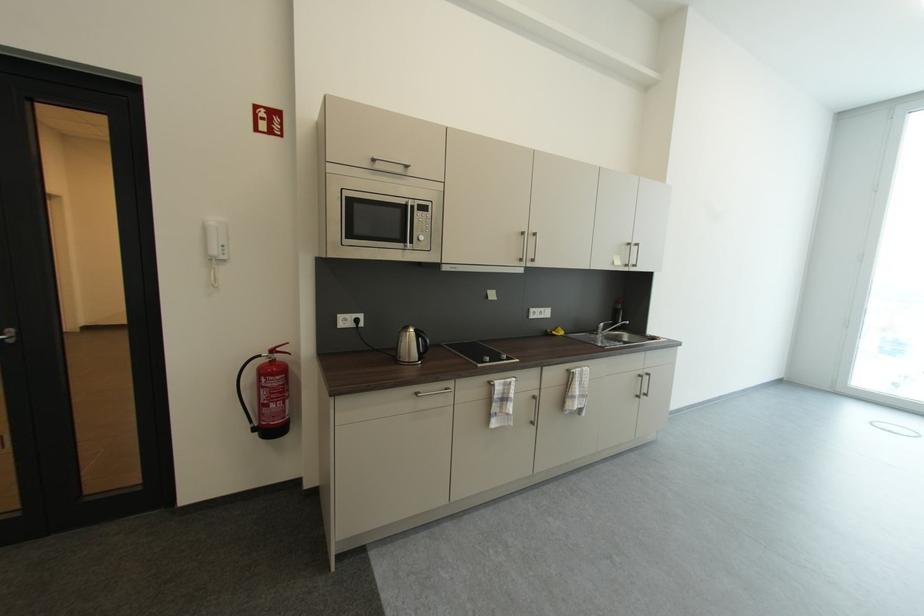
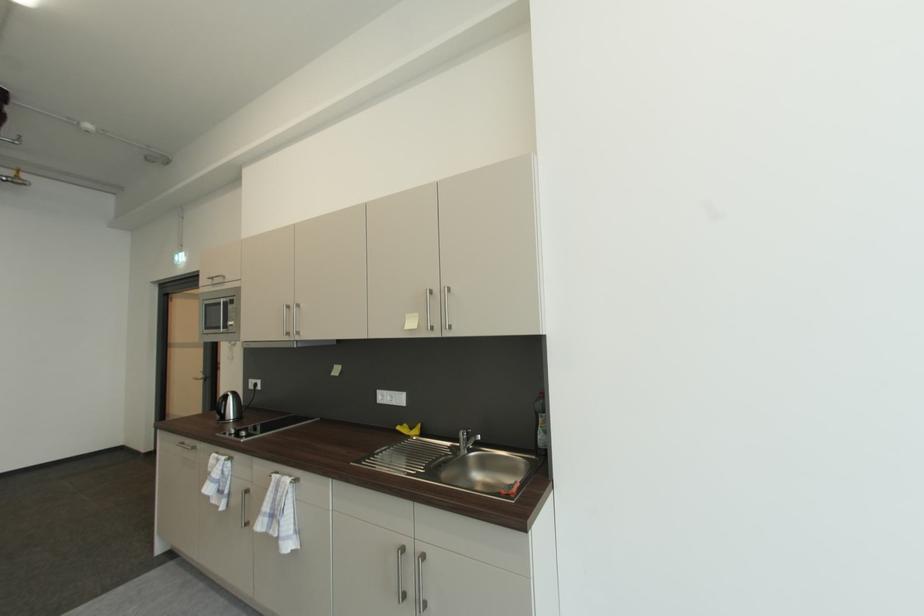
Locate, in the second image, the point that corresponds to point 579,373 in the first image.

(277, 477)